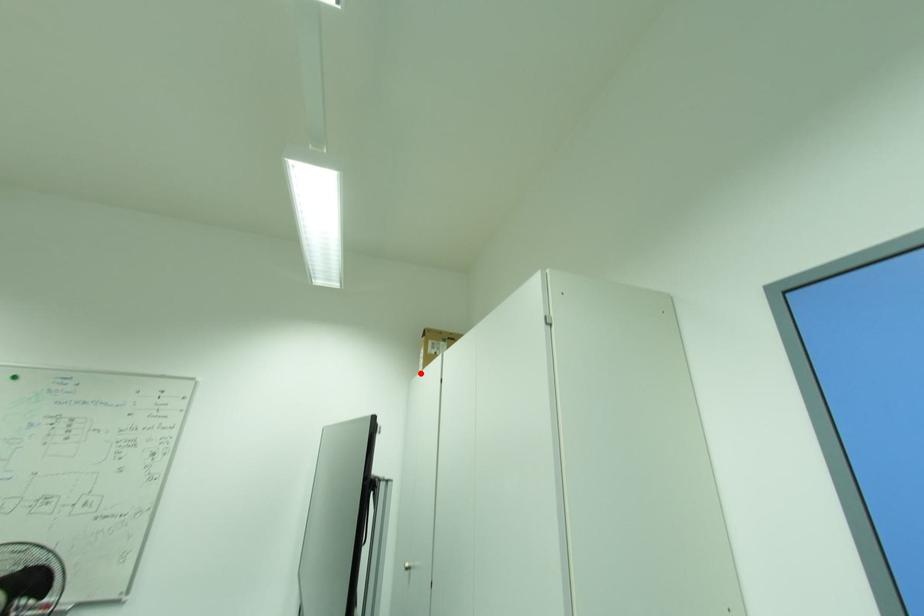
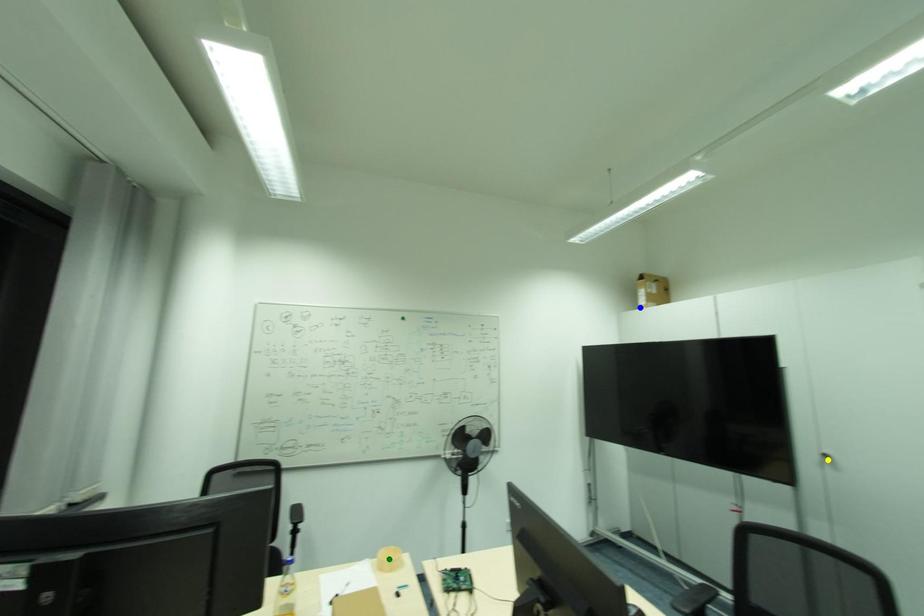
Question: I am providing you with two images of the same scene from different viewpoints. A red point is marked on the first image. You are given multiple points on the second image. Which mark in image 2 goes with the point in image 1?

Choices:
 (A) green point
 (B) blue point
 (C) yellow point

Answer: (B)